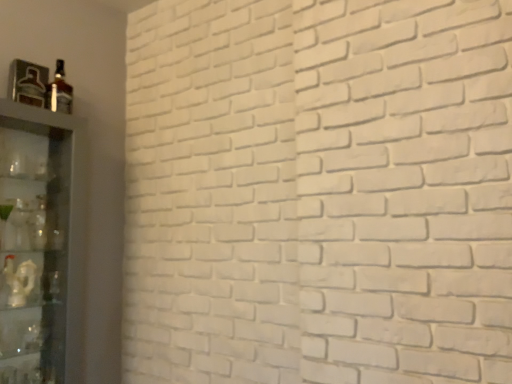
Question: From a real-world perspective, is matte glass bottle at upper left, acting as the second bottle starting from the left, on metallic glass bottle at upper left, placed as the first bottle when sorted from left to right?

Choices:
 (A) no
 (B) yes

Answer: (B)

Question: Does matte glass bottle at upper left, which is the first bottle from right to left, have a lesser height compared to metallic glass bottle at upper left, which is counted as the 2th bottle, starting from the right?

Choices:
 (A) yes
 (B) no

Answer: (B)

Question: Is matte glass bottle at upper left, which is the first bottle from right to left, at the right side of metallic glass bottle at upper left, which is counted as the 2th bottle, starting from the right?

Choices:
 (A) yes
 (B) no

Answer: (A)

Question: Is matte glass bottle at upper left, which is the first bottle from right to left, not within metallic glass bottle at upper left, which is counted as the 2th bottle, starting from the right?

Choices:
 (A) no
 (B) yes

Answer: (B)

Question: Is matte glass bottle at upper left, which is the first bottle from right to left, positioned far away from metallic glass bottle at upper left, placed as the first bottle when sorted from left to right?

Choices:
 (A) yes
 (B) no

Answer: (B)

Question: Choose the correct answer: Is metallic glass bottle at upper left, which is counted as the 2th bottle, starting from the right, inside matte glass bottle at upper left, which is the first bottle from right to left, or outside it?

Choices:
 (A) inside
 (B) outside

Answer: (B)

Question: From the image's perspective, is metallic glass bottle at upper left, placed as the first bottle when sorted from left to right, located above or below matte glass bottle at upper left, acting as the second bottle starting from the left?

Choices:
 (A) above
 (B) below

Answer: (B)

Question: Is metallic glass bottle at upper left, which is counted as the 2th bottle, starting from the right, taller or shorter than matte glass bottle at upper left, which is the first bottle from right to left?

Choices:
 (A) tall
 (B) short

Answer: (B)

Question: From a real-world perspective, relative to matte glass bottle at upper left, acting as the second bottle starting from the left, is metallic glass bottle at upper left, which is counted as the 2th bottle, starting from the right, vertically above or below?

Choices:
 (A) below
 (B) above

Answer: (A)

Question: From their relative heights in the image, would you say clear glass shelf at left is taller or shorter than metallic glass bottle at upper left, placed as the first bottle when sorted from left to right?

Choices:
 (A) tall
 (B) short

Answer: (A)

Question: Is point (51, 349) closer or farther from the camera than point (40, 84)?

Choices:
 (A) farther
 (B) closer

Answer: (B)

Question: From the image's perspective, is clear glass shelf at left positioned above or below metallic glass bottle at upper left, which is counted as the 2th bottle, starting from the right?

Choices:
 (A) below
 (B) above

Answer: (A)

Question: Would you say clear glass shelf at left is inside or outside metallic glass bottle at upper left, placed as the first bottle when sorted from left to right?

Choices:
 (A) outside
 (B) inside

Answer: (A)

Question: Looking at their shapes, would you say clear glass shelf at left is wider or thinner than matte glass bottle at upper left, acting as the second bottle starting from the left?

Choices:
 (A) thin
 (B) wide

Answer: (B)

Question: Is clear glass shelf at left in front of or behind matte glass bottle at upper left, acting as the second bottle starting from the left, in the image?

Choices:
 (A) behind
 (B) front

Answer: (B)